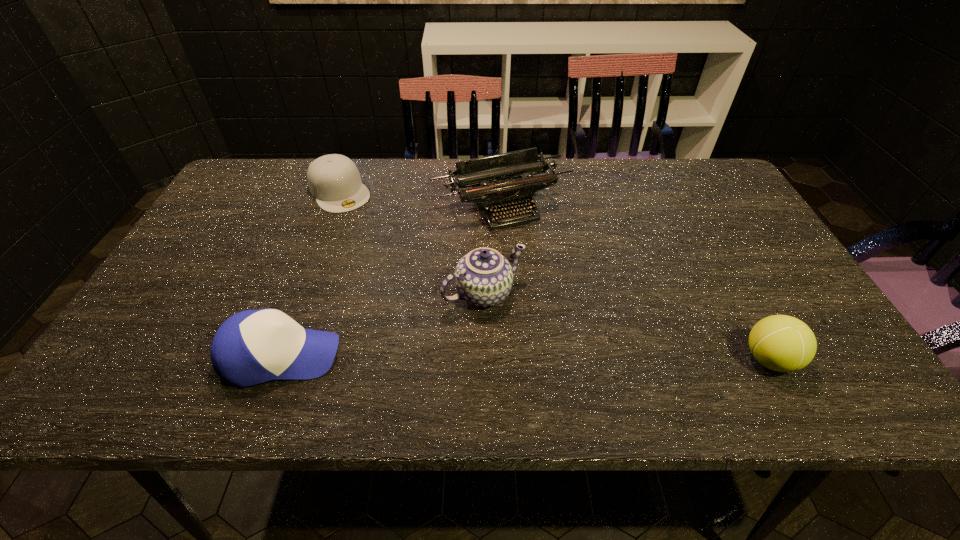
Locate an element on the screen. free space on the desktop that is between the baseball cap and the tennis ball and is positioned on the typing side of the typewriter is located at coordinates (588, 358).

This screenshot has width=960, height=540. I want to click on vacant space on the desktop that is between the baseball cap and the rightmost object and is positioned on the front-facing side of the cap, so point(455,357).

Where is `vacant space on the desktop that is between the baseball cap and the tennis ball and is positioned at the spout of the chinaware`? This screenshot has height=540, width=960. vacant space on the desktop that is between the baseball cap and the tennis ball and is positioned at the spout of the chinaware is located at coordinates (535, 357).